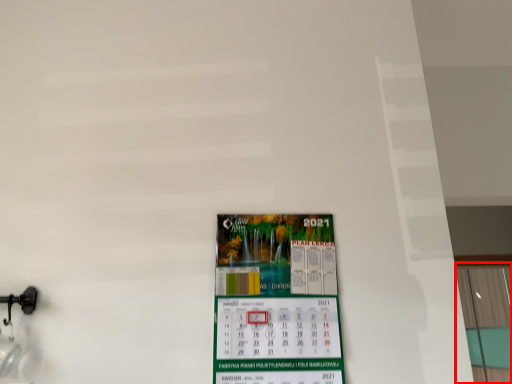
Question: From the image, what is the correct spatial relationship of window (annotated by the red box) in relation to poster?

Choices:
 (A) right
 (B) left

Answer: (A)